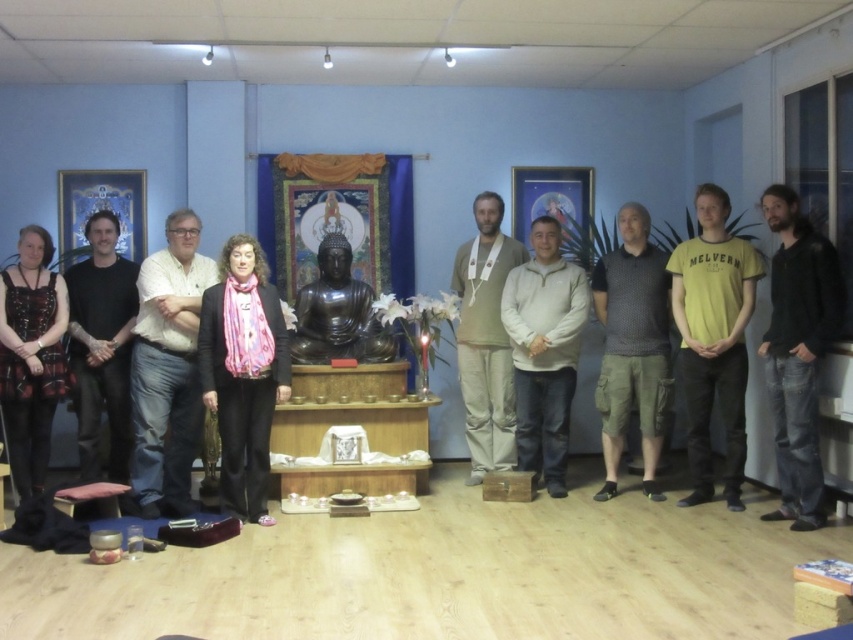
Is point (184, 296) less distant than point (312, 352)?

Yes, it is.

Does point (144, 266) come in front of point (352, 288)?

That is True.

You are a GUI agent. You are given a task and a screenshot of the screen. Output one action in this format:
    pyautogui.click(x=<x>, y=<y>)
    Task: Click on the white shirt at center
    The height and width of the screenshot is (640, 853).
    Given the screenshot: What is the action you would take?
    pyautogui.click(x=167, y=369)

Consider the image. Does white shirt at center have a smaller size compared to black matte shirt at left?

Actually, white shirt at center might be larger than black matte shirt at left.

Is point (183, 324) farther from camera compared to point (117, 413)?

No.

The width and height of the screenshot is (853, 640). What do you see at coordinates (167, 369) in the screenshot? I see `white shirt at center` at bounding box center [167, 369].

This screenshot has height=640, width=853. What are the coordinates of `white shirt at center` in the screenshot? It's located at (167, 369).

Can you confirm if dark gray textured shirt at center is bigger than white fleece jacket at center?

No.

Between point (657, 492) and point (558, 440), which one is positioned behind?

Point (558, 440)

Between point (648, 333) and point (550, 296), which one is positioned behind?

Positioned behind is point (550, 296).

I want to click on dark gray textured shirt at center, so click(x=631, y=346).